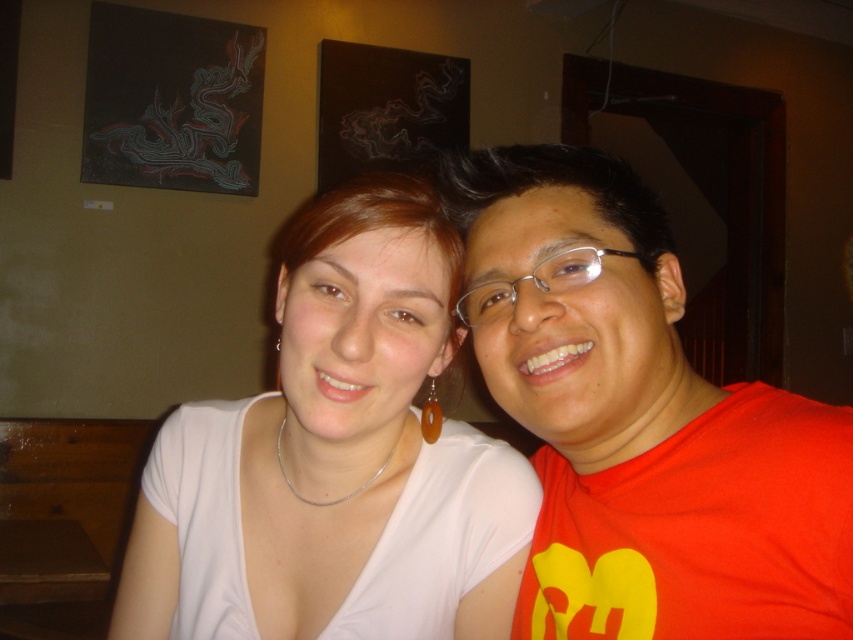
Question: Which object appears farthest from the camera in this image?

Choices:
 (A) white matte shirt at center
 (B) clear plastic glasses at center

Answer: (B)

Question: Is matte red t-shirt at right closer to camera compared to white matte shirt at center?

Choices:
 (A) yes
 (B) no

Answer: (A)

Question: In this image, where is white matte shirt at center located relative to clear plastic glasses at center?

Choices:
 (A) left
 (B) right

Answer: (A)

Question: Is matte red t-shirt at right closer to camera compared to white matte shirt at center?

Choices:
 (A) yes
 (B) no

Answer: (A)

Question: Which point is farther from the camera taking this photo?

Choices:
 (A) (267, 433)
 (B) (631, 600)
 (C) (543, 275)

Answer: (A)

Question: Which object is closer to the camera taking this photo?

Choices:
 (A) clear plastic glasses at center
 (B) matte red t-shirt at right
 (C) white matte shirt at center

Answer: (B)